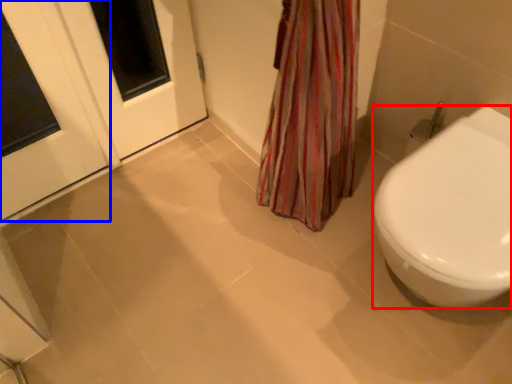
Question: Among these objects, which one is farthest to the camera, bidet (highlighted by a red box) or door (highlighted by a blue box)?

Choices:
 (A) bidet
 (B) door

Answer: (B)